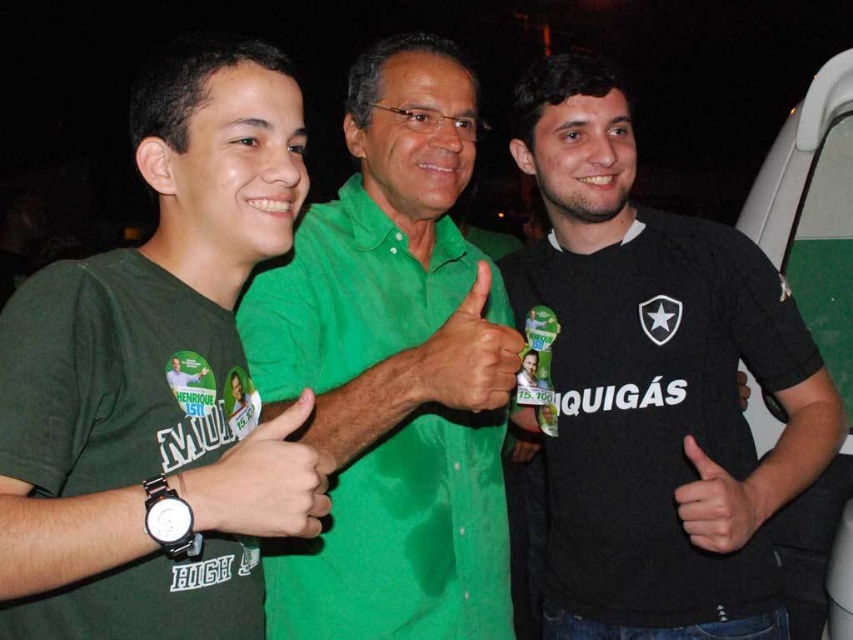
In the scene shown: You are a photographer trying to capture a closeup of the black matte wristwatch at center and the green matte shirt at center. Which object should you zoom in on first to ensure it fits in the frame?

The black matte wristwatch at center has a lesser width compared to the green matte shirt at center, so you should zoom in on the black matte wristwatch at center first to ensure it fits in the frame before adjusting for the wider green matte shirt at center.

You are a photographer who needs to ensure that both the green matte shirt at center and the black matte hand at center are clearly visible in the photo. Based on their positions, which object should you focus on to ensure both are in focus?

The green matte shirt at center is in front of the black matte hand at center. To ensure both are in focus, focus on the green matte shirt at center since it is closer to the camera, allowing the hand behind it to also be in focus within the depth of field.